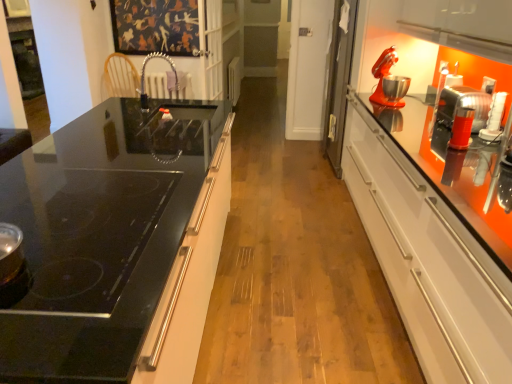
Question: Is orange metallic mixer at right, which is the 2th appliance in back-to-front order, behind satin nickel faucet at center?

Choices:
 (A) no
 (B) yes

Answer: (A)

Question: From a real-world perspective, is orange metallic mixer at right, the 1th appliance in the bottom-to-top sequence, beneath satin nickel faucet at center?

Choices:
 (A) yes
 (B) no

Answer: (A)

Question: From the image's perspective, would you say orange metallic mixer at right, which is the 1th appliance from right to left, is shown under satin nickel faucet at center?

Choices:
 (A) yes
 (B) no

Answer: (A)

Question: Is satin nickel faucet at center located within orange metallic mixer at right, which is the 2th appliance in back-to-front order?

Choices:
 (A) yes
 (B) no

Answer: (B)

Question: From a real-world perspective, is orange metallic mixer at right, which is the 1th appliance from right to left, over satin nickel faucet at center?

Choices:
 (A) yes
 (B) no

Answer: (B)

Question: From the image's perspective, relative to black glass cooktop at left, is satin nickel faucet at center above or below?

Choices:
 (A) below
 (B) above

Answer: (B)

Question: Is satin nickel faucet at center wider or thinner than black glass cooktop at left?

Choices:
 (A) thin
 (B) wide

Answer: (A)

Question: Considering the positions of satin nickel faucet at center and black glass cooktop at left in the image, is satin nickel faucet at center taller or shorter than black glass cooktop at left?

Choices:
 (A) tall
 (B) short

Answer: (B)

Question: Considering the positions of satin nickel faucet at center and black glass cooktop at left in the image, is satin nickel faucet at center bigger or smaller than black glass cooktop at left?

Choices:
 (A) big
 (B) small

Answer: (B)

Question: Is orange metallic mixer at right, which is the 2th appliance in back-to-front order, taller or shorter than white plastic radiator at center, the first appliance positioned from the back?

Choices:
 (A) tall
 (B) short

Answer: (B)

Question: In terms of size, does orange metallic mixer at right, the 1th appliance in the bottom-to-top sequence, appear bigger or smaller than white plastic radiator at center, the first appliance positioned from the back?

Choices:
 (A) small
 (B) big

Answer: (A)

Question: Is orange metallic mixer at right, the first appliance when ordered from front to back, wider or thinner than white plastic radiator at center, positioned as the second appliance in front-to-back order?

Choices:
 (A) wide
 (B) thin

Answer: (A)

Question: Does point (483, 122) appear closer or farther from the camera than point (234, 66)?

Choices:
 (A) closer
 (B) farther

Answer: (A)

Question: Visually, is matte red mixer at upper right positioned to the left or to the right of black glass cooktop at left?

Choices:
 (A) left
 (B) right

Answer: (B)

Question: From the image's perspective, is matte red mixer at upper right located above or below black glass cooktop at left?

Choices:
 (A) below
 (B) above

Answer: (B)